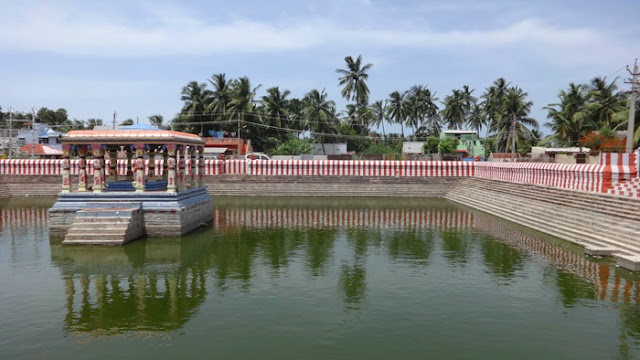
Identify the location of stairs. (109, 239).